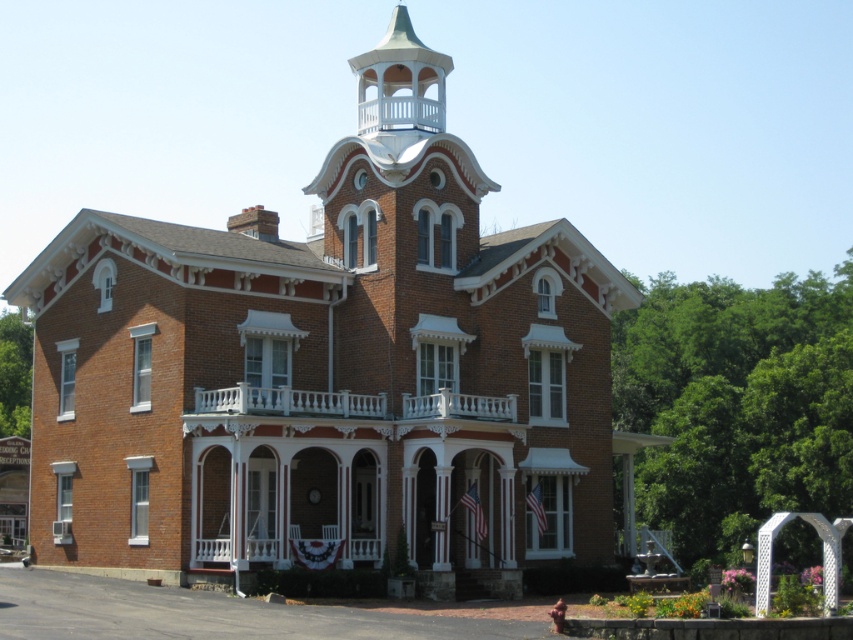
Question: Can you confirm if brick house at center is positioned to the right of white carved wood porch at center?

Choices:
 (A) yes
 (B) no

Answer: (B)

Question: Is brick house at center positioned before white carved wood porch at center?

Choices:
 (A) no
 (B) yes

Answer: (B)

Question: Among these objects, which one is farthest from the camera?

Choices:
 (A) white carved wood porch at center
 (B) brick house at center
 (C) white painted wood porch at lower center
 (D) white painted wood spire at upper center

Answer: (D)

Question: Which point is closer to the camera?

Choices:
 (A) white painted wood spire at upper center
 (B) white carved wood porch at center

Answer: (B)

Question: Does white painted wood spire at upper center appear over white painted wood porch at lower center?

Choices:
 (A) no
 (B) yes

Answer: (B)

Question: Considering the real-world distances, which object is closest to the white painted wood porch at lower center?

Choices:
 (A) white painted wood spire at upper center
 (B) white carved wood porch at center
 (C) brick house at center

Answer: (B)